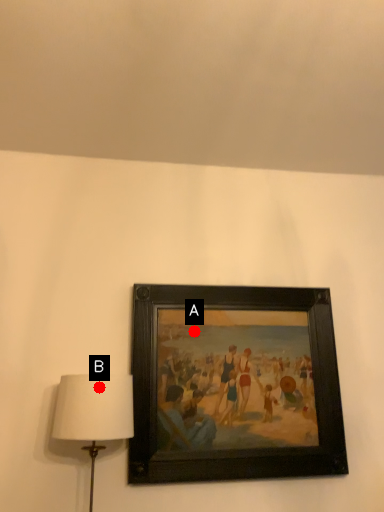
Question: Two points are circled on the image, labeled by A and B beside each circle. Which point appears closest to the camera in this image?

Choices:
 (A) A is closer
 (B) B is closer

Answer: (B)